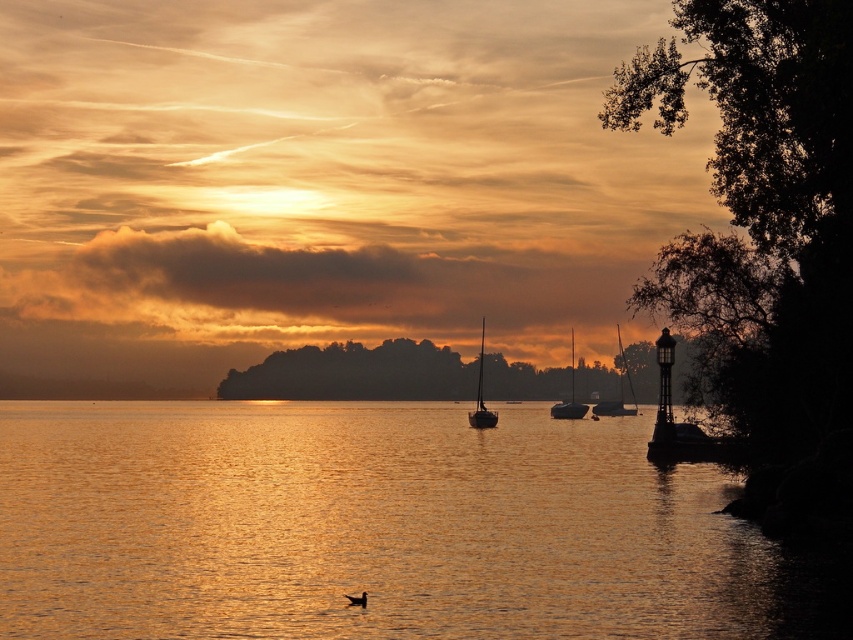
Can you confirm if shiny silver sailboat at center is shorter than satin black sailboat at center?

Indeed, shiny silver sailboat at center has a lesser height compared to satin black sailboat at center.

Is point (625, 380) more distant than point (492, 413)?

Yes, it is behind point (492, 413).

Where is `shiny silver sailboat at center`? The width and height of the screenshot is (853, 640). shiny silver sailboat at center is located at coordinates (619, 390).

Can you confirm if golden reflective water at center is smaller than satin black sailboat at center?

No, golden reflective water at center is not smaller than satin black sailboat at center.

Is golden reflective water at center wider than satin black sailboat at center?

Indeed, golden reflective water at center has a greater width compared to satin black sailboat at center.

The image size is (853, 640). I want to click on golden reflective water at center, so (370, 525).

Locate an element on the screen. golden reflective water at center is located at coordinates (370, 525).

Is point (474, 426) positioned in front of point (572, 412)?

Yes, point (474, 426) is in front of point (572, 412).

Find the location of a particular element. The width and height of the screenshot is (853, 640). satin black sailboat at center is located at coordinates (480, 394).